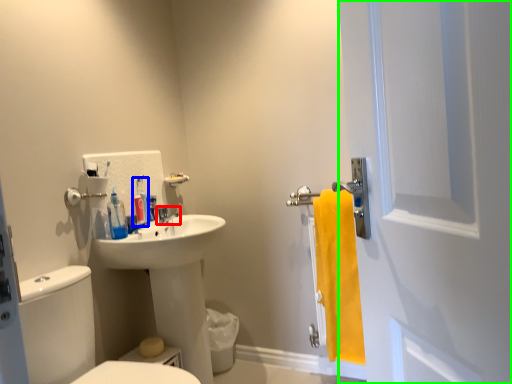
Question: Which object is the farthest from tap (highlighted by a red box)? Choose among these: toiletry (highlighted by a blue box) or screen door (highlighted by a green box).

Choices:
 (A) toiletry
 (B) screen door

Answer: (B)